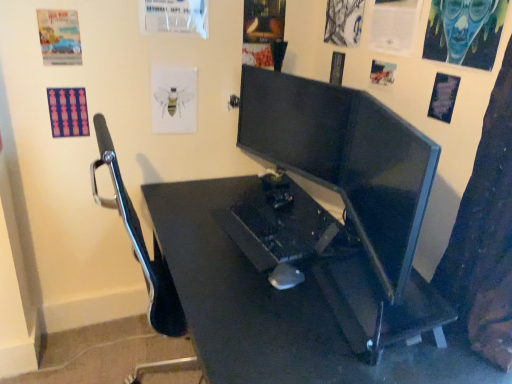
Locate an element on the screen. The image size is (512, 384). vacant space in front of black plastic mouse at center is located at coordinates (284, 312).